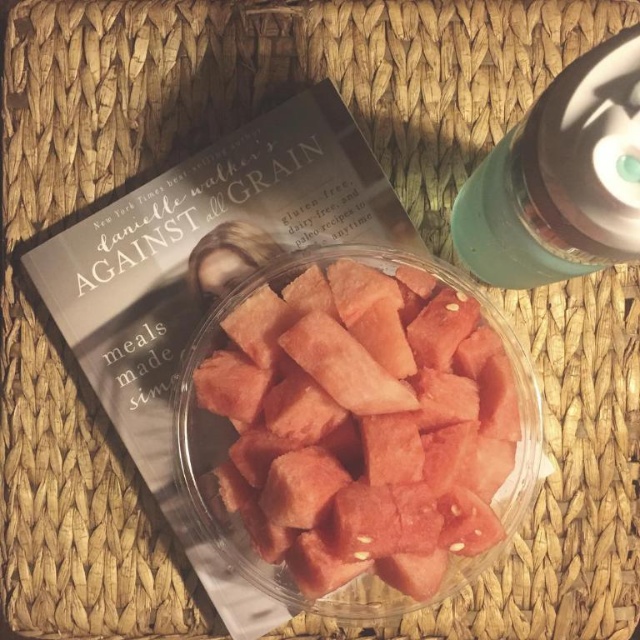
Which of these two, pink juicy watermelon at center or green matte bottle at upper right, stands shorter?

Standing shorter between the two is green matte bottle at upper right.

Can you confirm if pink juicy watermelon at center is taller than green matte bottle at upper right?

Correct, pink juicy watermelon at center is much taller as green matte bottle at upper right.

Is point (448, 390) more distant than point (573, 134)?

Yes, it is.

Locate an element on the screen. The width and height of the screenshot is (640, 640). pink juicy watermelon at center is located at coordinates (364, 424).